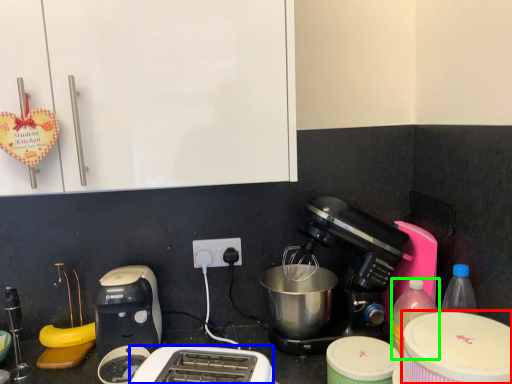
Question: Which object is the farthest from appliance (highlighted by a red box)? Choose among these: toaster (highlighted by a blue box) or bottle (highlighted by a green box).

Choices:
 (A) toaster
 (B) bottle

Answer: (A)